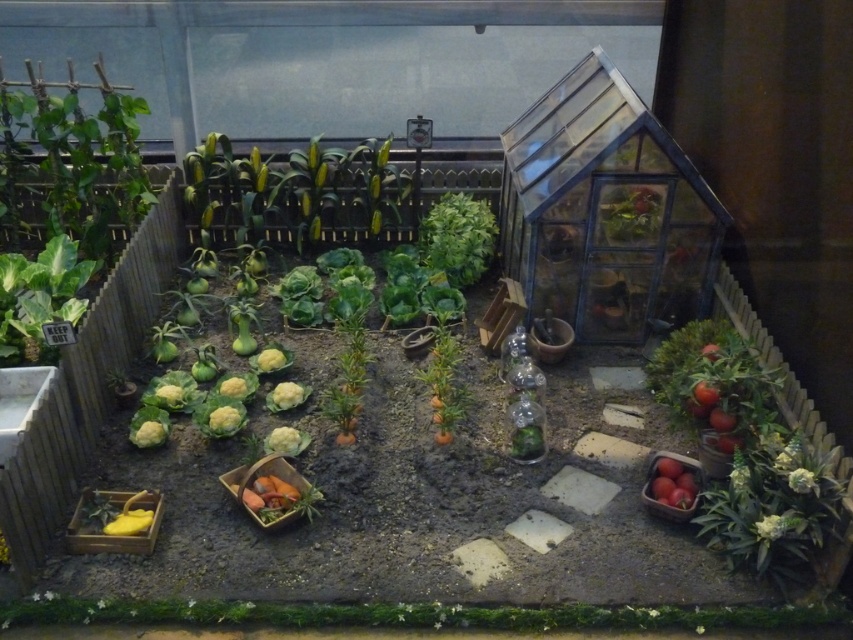
How distant is green leafy plant at left from red matte tomatoes at lower right?

green leafy plant at left and red matte tomatoes at lower right are 7.23 feet apart.

Is green leafy plant at left taller than red matte tomatoes at lower right?

Yes.

Does point (19, 353) come farther from viewer compared to point (676, 484)?

Yes, point (19, 353) is farther from viewer.

I want to click on green leafy plant at left, so (x=39, y=296).

Is yellow-green leaves at upper center bigger than green leafy at center?

Indeed, yellow-green leaves at upper center has a larger size compared to green leafy at center.

The height and width of the screenshot is (640, 853). What do you see at coordinates (294, 193) in the screenshot?
I see `yellow-green leaves at upper center` at bounding box center [294, 193].

Find the location of `yellow-green leaves at upper center`. yellow-green leaves at upper center is located at coordinates (294, 193).

Can you confirm if yellow-green leaves at upper center is positioned above green leafy plant at left?

Yes.

Does yellow-green leaves at upper center appear on the right side of green leafy plant at left?

Indeed, yellow-green leaves at upper center is positioned on the right side of green leafy plant at left.

This screenshot has width=853, height=640. Find the location of `yellow-green leaves at upper center`. yellow-green leaves at upper center is located at coordinates (294, 193).